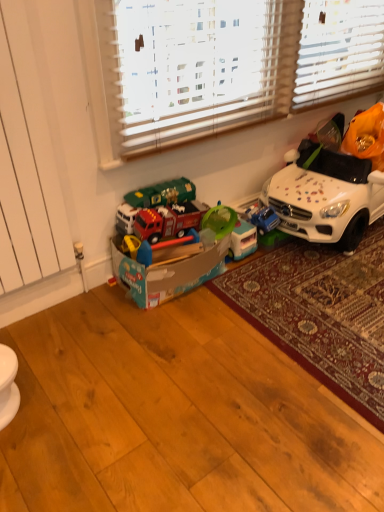
This screenshot has width=384, height=512. I want to click on vacant region to the right of blue plastic toy car at center, positioned as the 1th toy in right-to-left order, so click(292, 251).